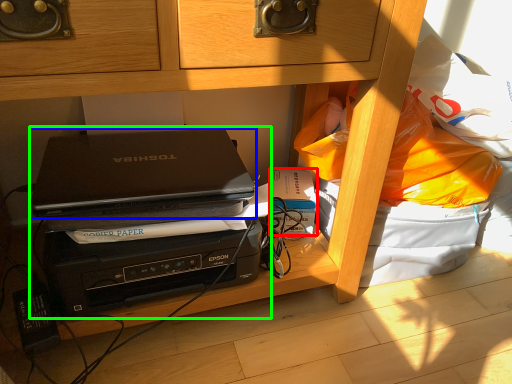
Question: Which object is the closest to the paperback book (highlighted by a red box)? Choose among these: laptop (highlighted by a blue box) or computer (highlighted by a green box).

Choices:
 (A) laptop
 (B) computer

Answer: (A)